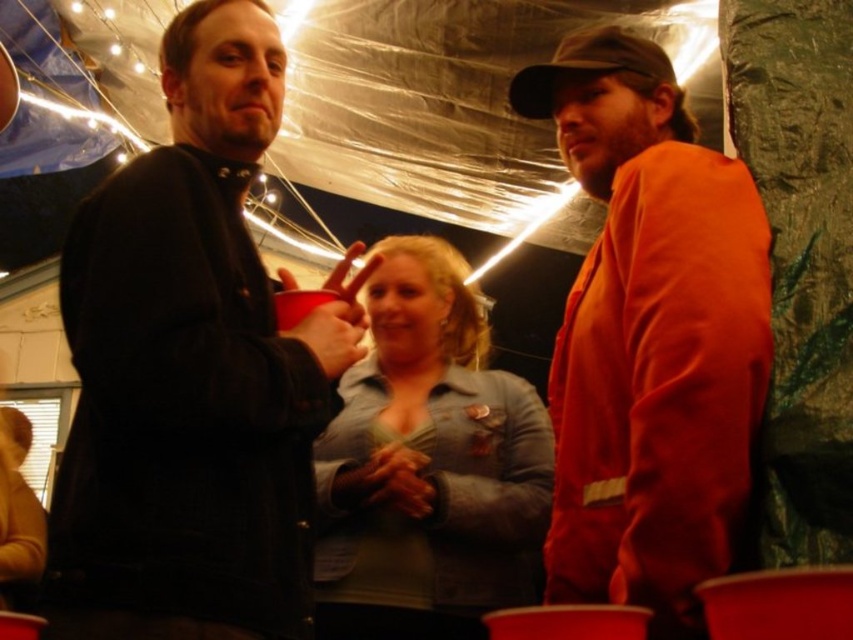
You are at a party and want to borrow a jacket from either the matte black jacket at left or the denim jacket at center. Which one is more likely to fit over a thick sweater?

The denim jacket at center is thicker than the matte black jacket at left, so it would be more likely to fit over a thick sweater.

Based on the photo, you are standing at the entrance of the room and want to locate the matte black jacket at left. According to the coordinates, where would you find it?

The matte black jacket at left is located at coordinates point [190,371].

You are a photographer at a party and want to take a group photo of the orange cotton shirt at right and the denim jacket at center. If your camera has a maximum focus range of 40 feet, will you be able to capture both subjects clearly in the same photo?

The distance between the orange cotton shirt at right and the denim jacket at center is 44.28 feet, which exceeds the camera maximum focus range of 40 feet. Therefore, you cannot capture both subjects clearly in the same photo.